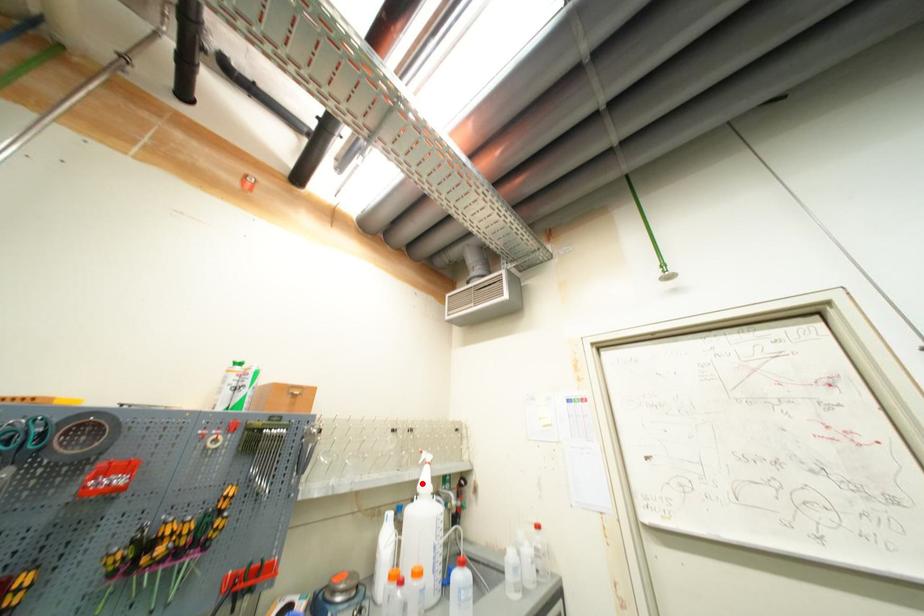
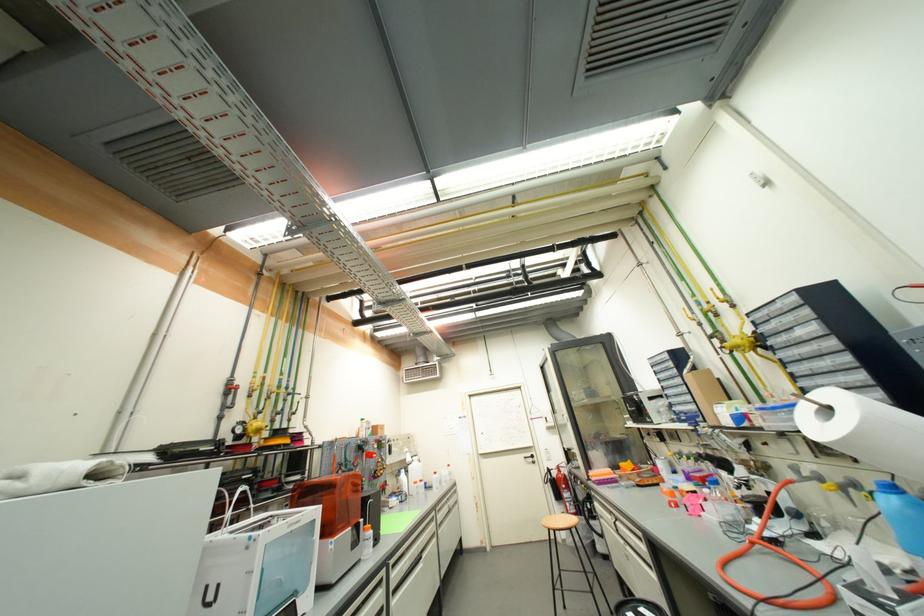
Find the pixel in the second image that matches the highlighted location in the first image.

(410, 461)